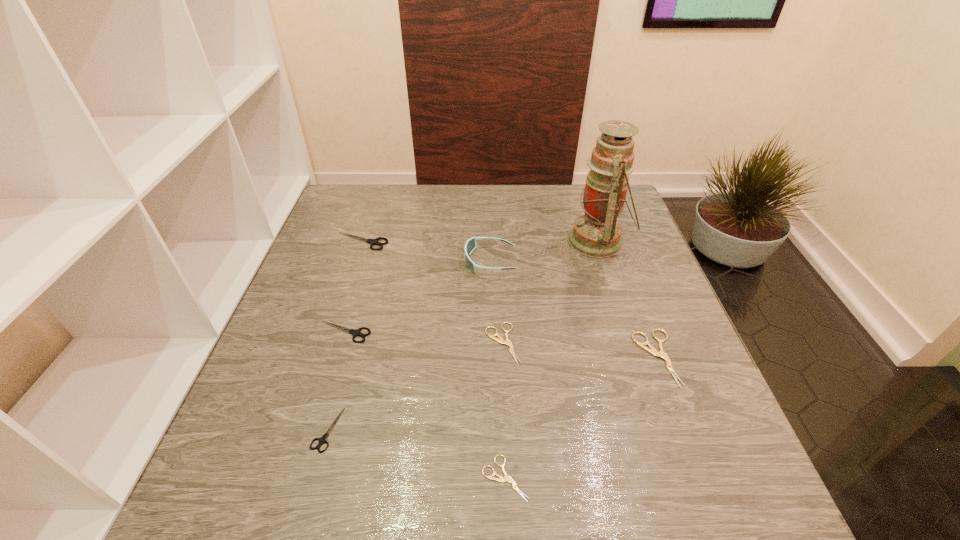
At what (x,y) coordinates should I click in order to perform the action: click on free space between the biggest beige shears and the red oil lamp. Please return your answer as a coordinate pair (x, y). Looking at the image, I should click on (627, 300).

Where is `free space that is in between the second smallest beige shears and the biggest beige shears`? free space that is in between the second smallest beige shears and the biggest beige shears is located at coordinates (580, 350).

In order to click on free space between the second smallest black shears and the nearest black shears in this screenshot , I will do `click(336, 381)`.

Where is `the third closest object to the rightmost beige shears`? The image size is (960, 540). the third closest object to the rightmost beige shears is located at coordinates (507, 478).

Find the location of `the sixth closest object to the oil lamp`. the sixth closest object to the oil lamp is located at coordinates (507, 478).

Point out which shears is positioned as the second nearest to the rightmost shears. Please provide its 2D coordinates. Your answer should be formatted as a tuple, i.e. [(x, y)], where the tuple contains the x and y coordinates of a point satisfying the conditions above.

[(507, 478)]

Select which shears appears as the fourth closest to the farthest shears. Please provide its 2D coordinates. Your answer should be formatted as a tuple, i.e. [(x, y)], where the tuple contains the x and y coordinates of a point satisfying the conditions above.

[(507, 478)]

Identify which black shears is the second nearest to the rightmost beige shears. Please provide its 2D coordinates. Your answer should be formatted as a tuple, i.e. [(x, y)], where the tuple contains the x and y coordinates of a point satisfying the conditions above.

[(322, 440)]

Image resolution: width=960 pixels, height=540 pixels. Find the location of `black shears that is the third closest to the goggles`. black shears that is the third closest to the goggles is located at coordinates (322, 440).

Point out which beige shears is positioned as the nearest to the second biggest black shears. Please provide its 2D coordinates. Your answer should be formatted as a tuple, i.e. [(x, y)], where the tuple contains the x and y coordinates of a point satisfying the conditions above.

[(500, 340)]